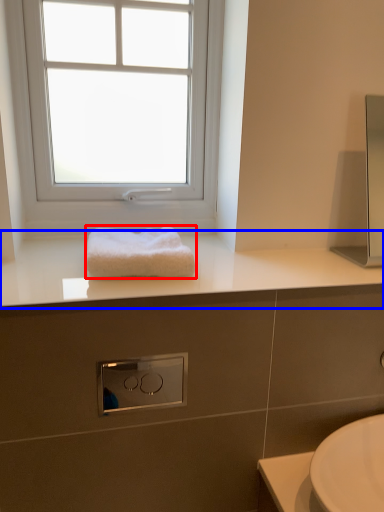
Question: Which point is closer to the camera, towel (highlighted by a red box) or countertop (highlighted by a blue box)?

Choices:
 (A) towel
 (B) countertop

Answer: (B)